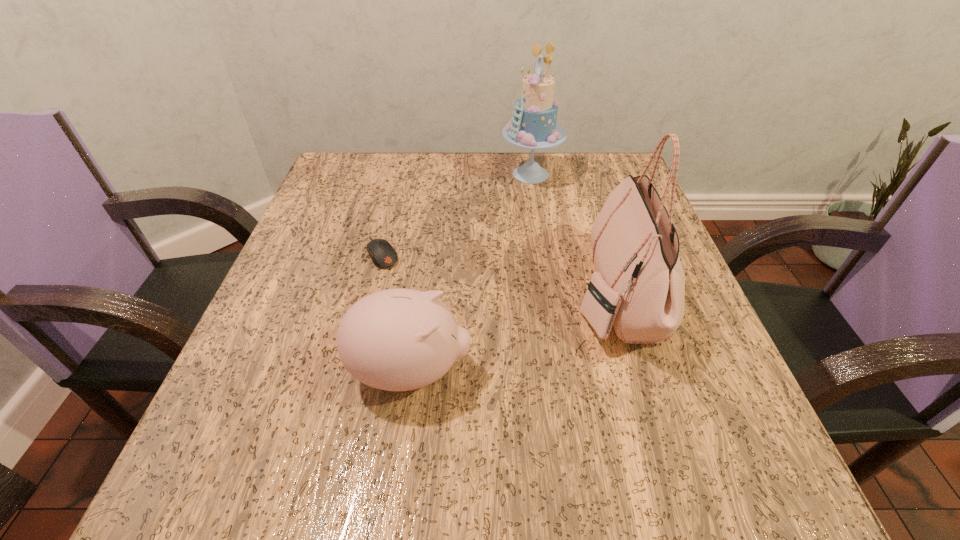
Find the location of a particular element. This screenshot has width=960, height=540. object that is the second closest to the handbag is located at coordinates (399, 339).

The image size is (960, 540). Find the location of `the third closest object relative to the cake`. the third closest object relative to the cake is located at coordinates (399, 339).